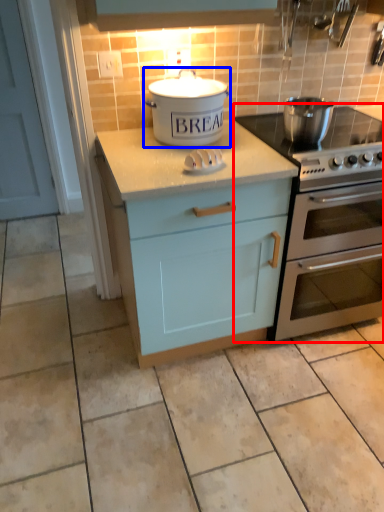
Question: Among these objects, which one is nearest to the camera, oven (highlighted by a red box) or kitchen appliance (highlighted by a blue box)?

Choices:
 (A) oven
 (B) kitchen appliance

Answer: (B)